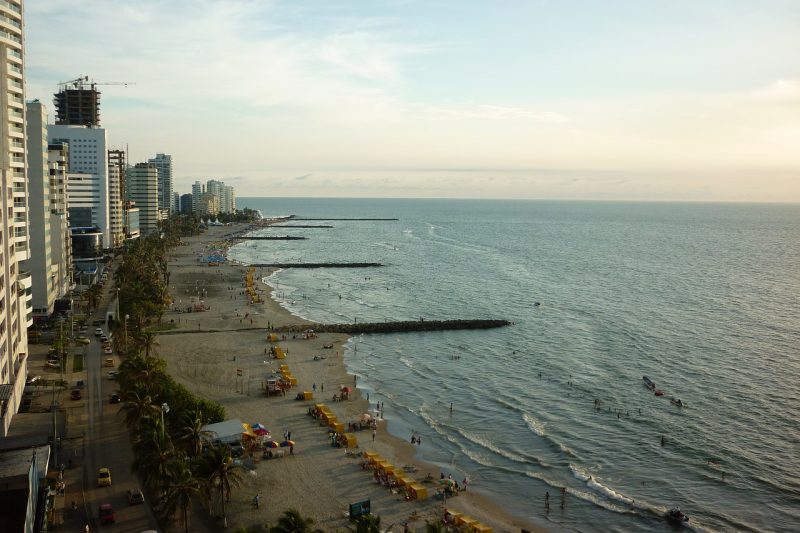
Locate an element on the screen. hotel is located at coordinates (9, 285), (42, 196), (93, 185), (142, 184), (162, 173), (225, 197).